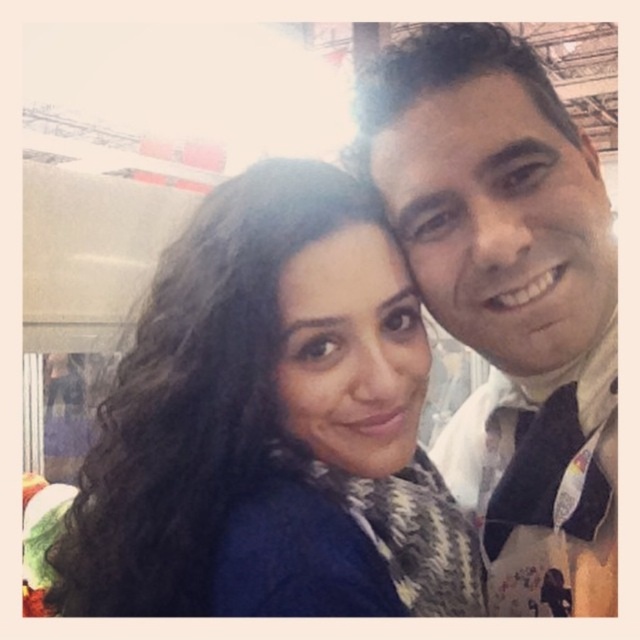
Question: Can you confirm if dark blue sweater at center is positioned to the right of white textured scarf at right?

Choices:
 (A) no
 (B) yes

Answer: (A)

Question: Is dark blue sweater at center positioned in front of white textured scarf at right?

Choices:
 (A) yes
 (B) no

Answer: (A)

Question: Is dark blue sweater at center above white textured scarf at right?

Choices:
 (A) no
 (B) yes

Answer: (A)

Question: Among these objects, which one is farthest from the camera?

Choices:
 (A) dark blue sweater at center
 (B) white textured scarf at right

Answer: (B)

Question: Which of the following is the closest to the observer?

Choices:
 (A) (356, 355)
 (B) (524, 182)

Answer: (A)

Question: Which point is closer to the camera?

Choices:
 (A) (452, 301)
 (B) (307, 228)

Answer: (B)